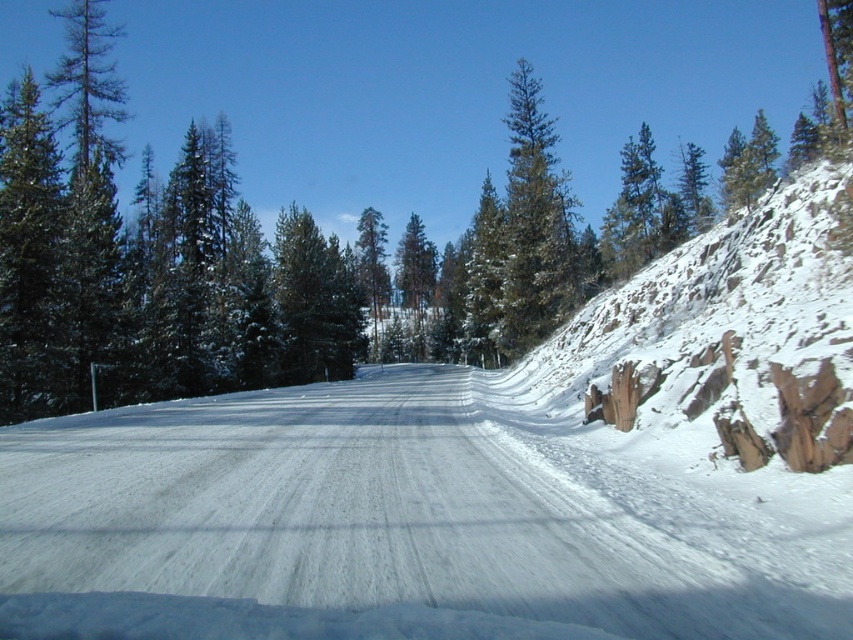
Question: Estimate the real-world distances between objects in this image. Which object is closer to the green textured pine tree at center?

Choices:
 (A) green textured pine at center
 (B) white snow-covered road at center

Answer: (A)

Question: Can you confirm if green textured pine at center is smaller than green textured pine tree at center?

Choices:
 (A) yes
 (B) no

Answer: (B)

Question: Can you confirm if white snow-covered road at center is wider than green textured pine at center?

Choices:
 (A) yes
 (B) no

Answer: (B)

Question: Among these objects, which one is farthest from the camera?

Choices:
 (A) white snow-covered road at center
 (B) green textured pine tree at center
 (C) green textured pine at center

Answer: (B)

Question: Which object appears farthest from the camera in this image?

Choices:
 (A) green textured pine at center
 (B) green textured pine tree at center

Answer: (B)

Question: Does white snow-covered road at center appear on the right side of green textured pine at center?

Choices:
 (A) yes
 (B) no

Answer: (B)